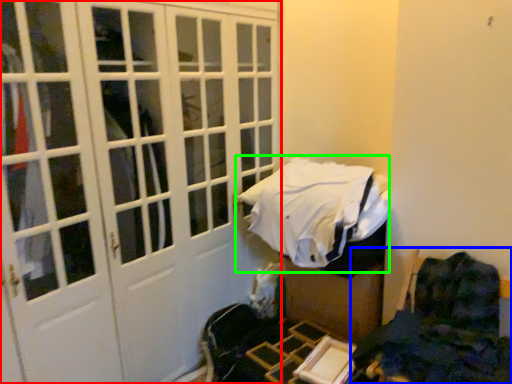
Question: Which object is the farthest from door (highlighted by a red box)? Choose among these: furniture (highlighted by a blue box) or bed (highlighted by a green box).

Choices:
 (A) furniture
 (B) bed

Answer: (A)